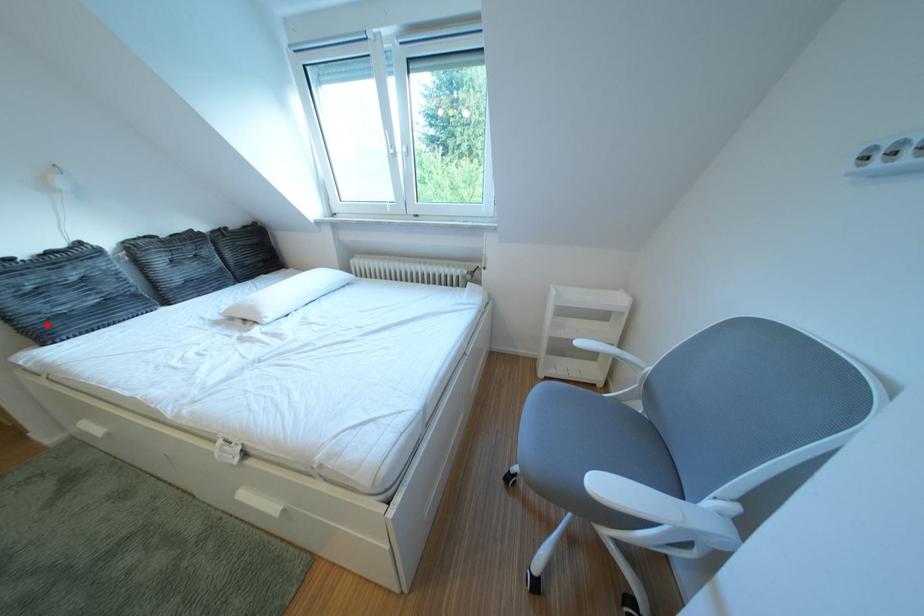
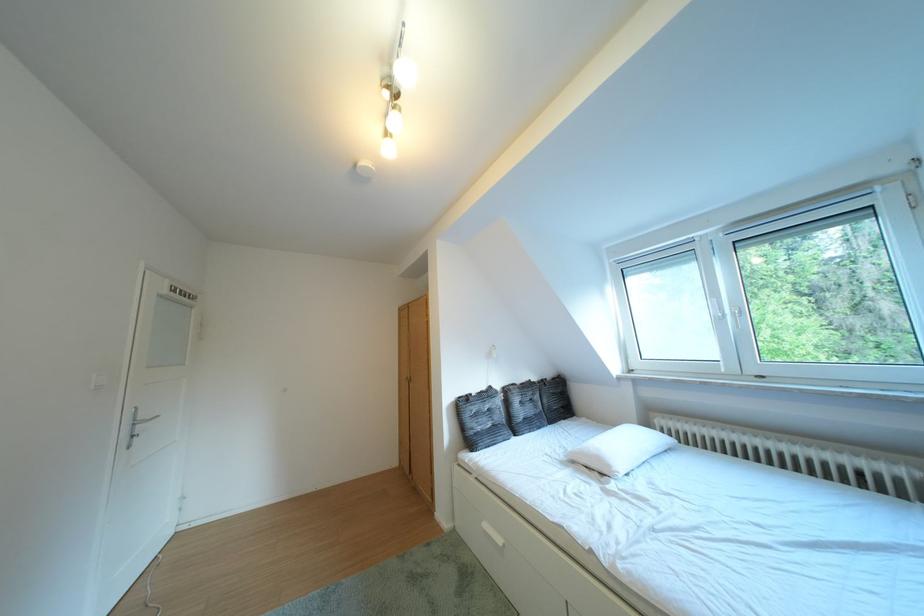
Locate, in the second image, the point that corresponds to the highlighted location in the first image.

(484, 438)